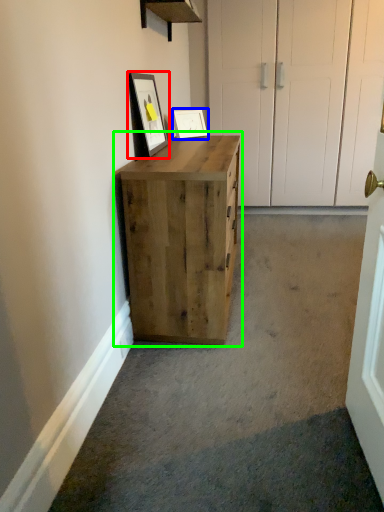
Question: Which is farther away from picture frame (highlighted by a red box)? picture frame (highlighted by a blue box) or chest of drawers (highlighted by a green box)?

Choices:
 (A) picture frame
 (B) chest of drawers

Answer: (B)